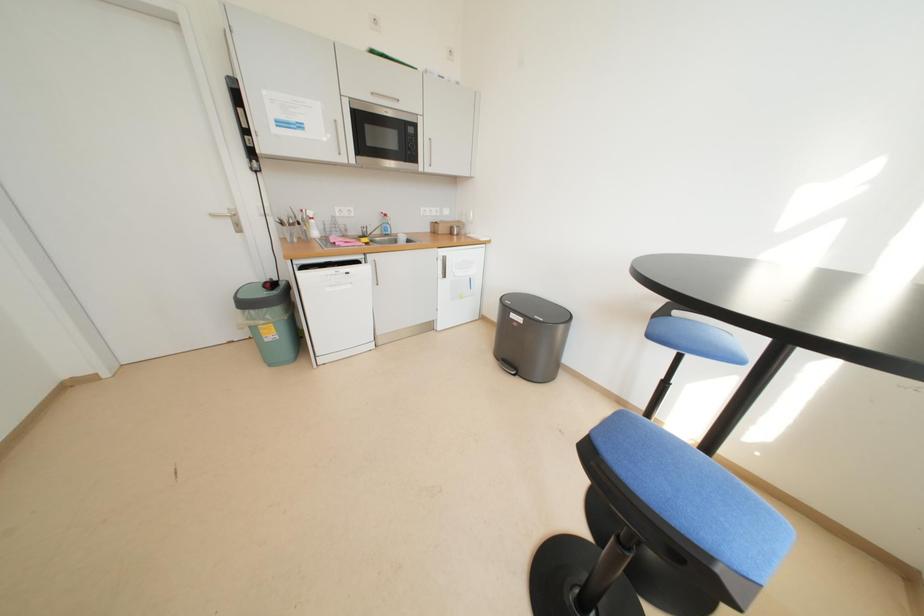
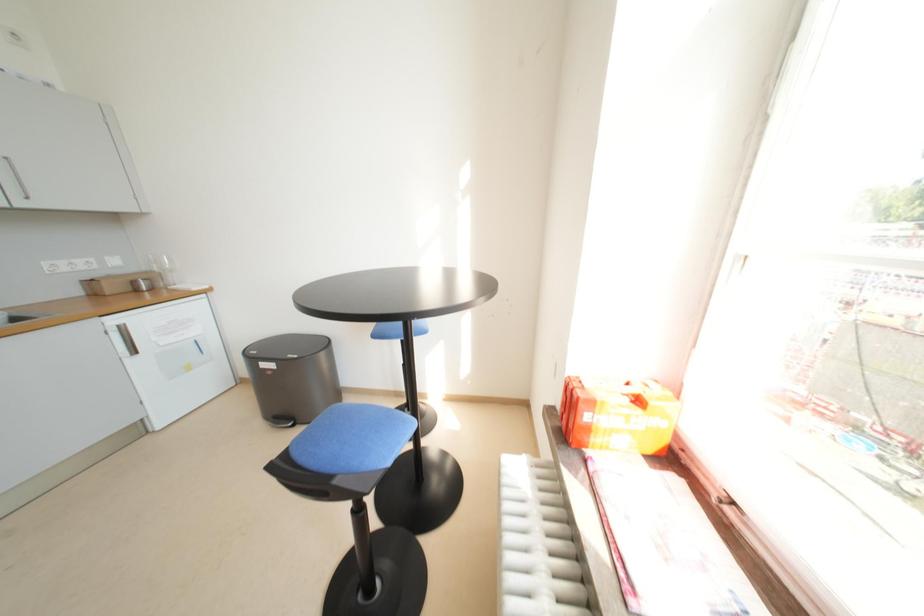
Question: The camera is either moving clockwise (left) or counter-clockwise (right) around the object. The first image is from the beginning of the video and the second image is from the end. Is the camera moving left or right when shooting the video?

Choices:
 (A) Left
 (B) Right

Answer: (A)